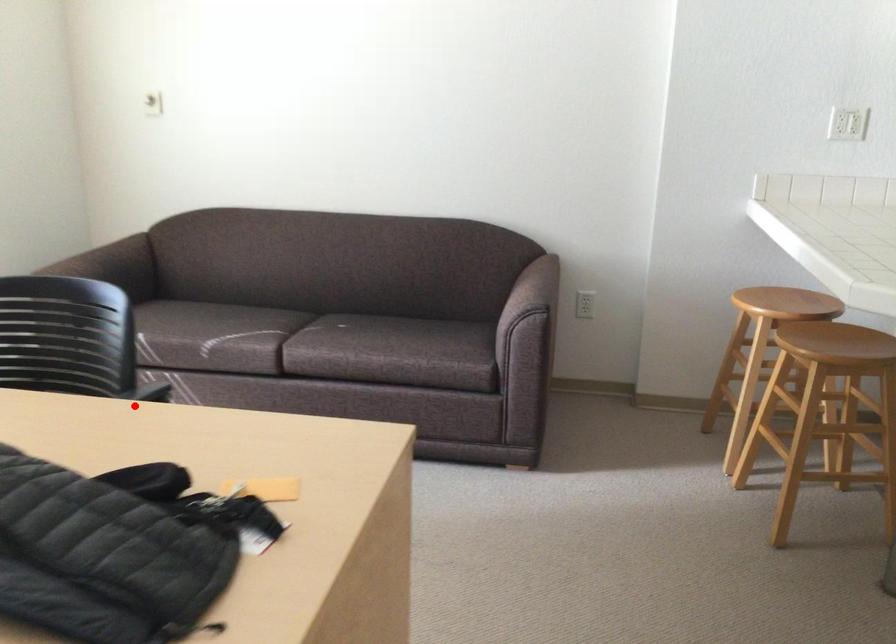
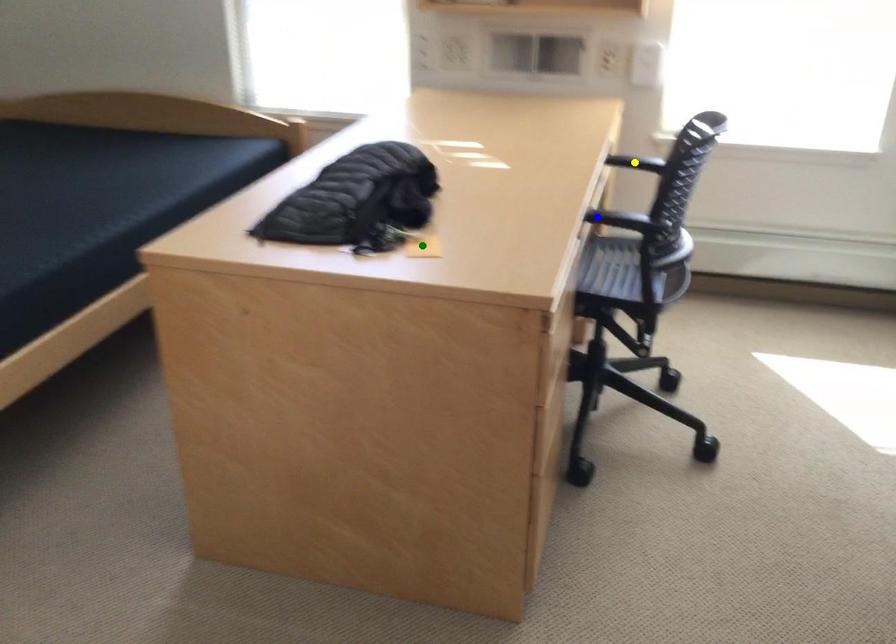
Question: I am providing you with two images of the same scene from different viewpoints. A red point is marked on the first image. You are given multiple points on the second image. In image 2, which mark is for the same physical point as the one in image 1?

Choices:
 (A) yellow point
 (B) green point
 (C) blue point

Answer: (C)